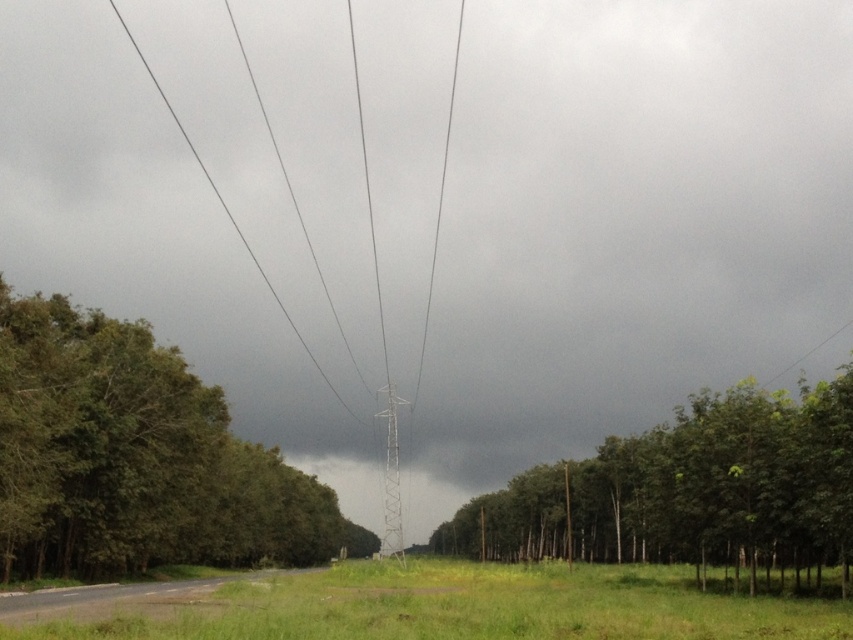
Where is `green leafy tree at left`? green leafy tree at left is located at coordinates (136, 458).

Can you confirm if green leafy tree at left is thinner than green leafy trees at center?

Yes.

This screenshot has width=853, height=640. What do you see at coordinates (136, 458) in the screenshot?
I see `green leafy tree at left` at bounding box center [136, 458].

Where is `green leafy tree at left`? Image resolution: width=853 pixels, height=640 pixels. green leafy tree at left is located at coordinates (136, 458).

Is point (705, 499) less distant than point (547, 593)?

No.

Can you confirm if green leafy trees at center is taller than green grass at center?

Yes, green leafy trees at center is taller than green grass at center.

This screenshot has width=853, height=640. What are the coordinates of `green leafy trees at center` in the screenshot? It's located at click(x=689, y=490).

Based on the photo, is green leafy tree at left wider than green grass at center?

In fact, green leafy tree at left might be narrower than green grass at center.

Is green leafy tree at left behind green grass at center?

Yes.

This screenshot has height=640, width=853. What do you see at coordinates (136, 458) in the screenshot? I see `green leafy tree at left` at bounding box center [136, 458].

You are a GUI agent. You are given a task and a screenshot of the screen. Output one action in this format:
    pyautogui.click(x=<x>, y=<y>)
    Task: Click on the green leafy tree at left
    
    Given the screenshot: What is the action you would take?
    pyautogui.click(x=136, y=458)